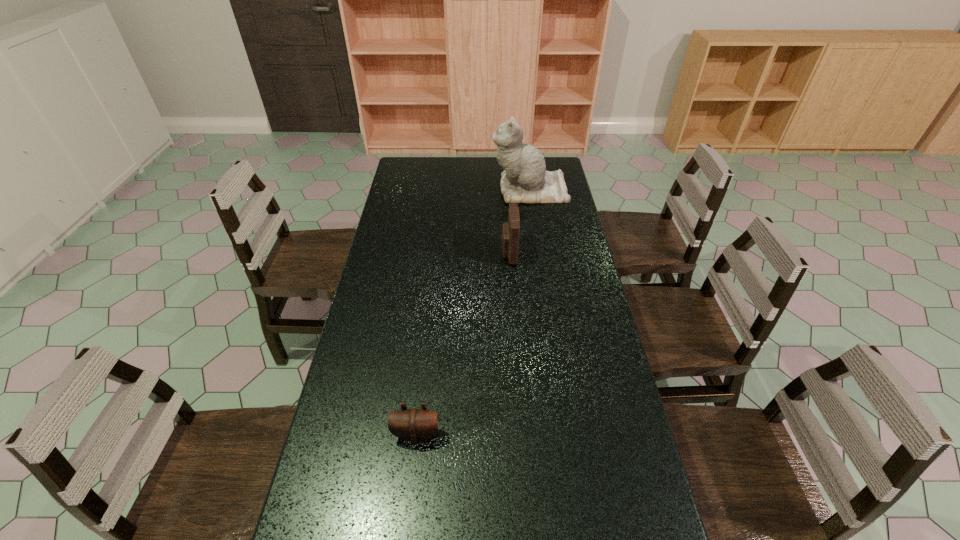
The width and height of the screenshot is (960, 540). Identify the location of vacant area that lies between the second nearest object and the shortest object. (463, 344).

The height and width of the screenshot is (540, 960). I want to click on empty location between the leftmost object and the second shortest object, so click(x=463, y=344).

Select which object is the second closest to the second shortest object. Please provide its 2D coordinates. Your answer should be formatted as a tuple, i.e. [(x, y)], where the tuple contains the x and y coordinates of a point satisfying the conditions above.

[(414, 425)]

Point out which object is positioned as the second nearest to the tallest object. Please provide its 2D coordinates. Your answer should be formatted as a tuple, i.e. [(x, y)], where the tuple contains the x and y coordinates of a point satisfying the conditions above.

[(414, 425)]

Find the location of a particular element. This screenshot has width=960, height=540. vacant point that satisfies the following two spatial constraints: 1. on the front-facing side of the cat; 2. with the flap open on the left pouch is located at coordinates (566, 434).

Identify the location of vacant region that satisfies the following two spatial constraints: 1. with an open flap on the second shortest object; 2. with the flap open on the nearest object. (522, 434).

The image size is (960, 540). I want to click on vacant region that satisfies the following two spatial constraints: 1. on the front-facing side of the cat; 2. with the flap open on the leftmost object, so click(566, 434).

Locate an element on the screen. This screenshot has height=540, width=960. vacant space that satisfies the following two spatial constraints: 1. on the front-facing side of the cat; 2. with the flap open on the shortest object is located at coordinates (566, 434).